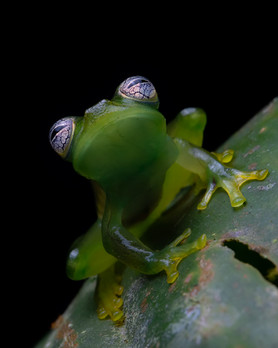
This screenshot has width=278, height=348. What are the coordinates of `top left corner empty space` in the screenshot? It's located at (3, 0).